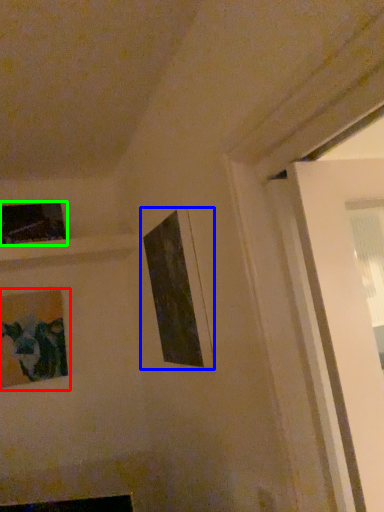
Question: Considering the real-world distances, which object is closest to picture frame (highlighted by a red box)? picture frame (highlighted by a blue box) or picture frame (highlighted by a green box).

Choices:
 (A) picture frame
 (B) picture frame

Answer: (B)